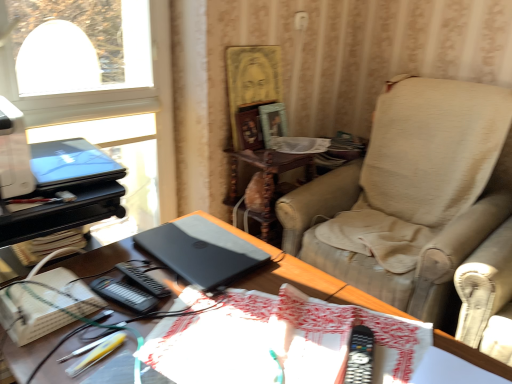
You are a GUI agent. You are given a task and a screenshot of the screen. Output one action in this format:
    pyautogui.click(x=<x>, y=<y>)
    Task: Click on the vacant space to the right of matte black laptop at center, which is counted as the first laptop, starting from the bottom
    Image resolution: width=512 pixels, height=384 pixels.
    Given the screenshot: What is the action you would take?
    pyautogui.click(x=294, y=282)